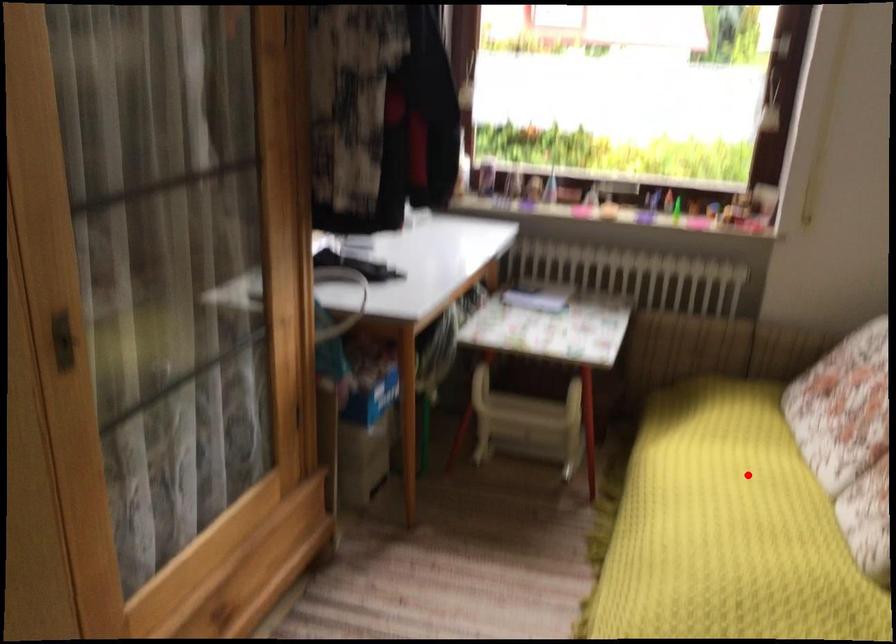
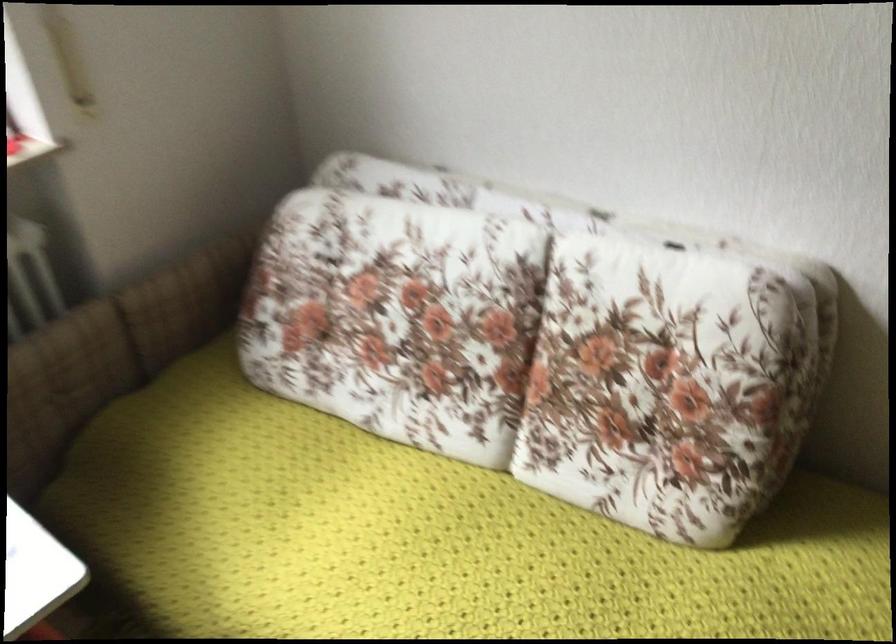
Question: A red point is marked in image1. In image2, is the corresponding 3D point closer to the camera or farther? Reply with the corresponding letter.

Choices:
 (A) The corresponding 3D point is closer.
 (B) The corresponding 3D point is farther.

Answer: (A)